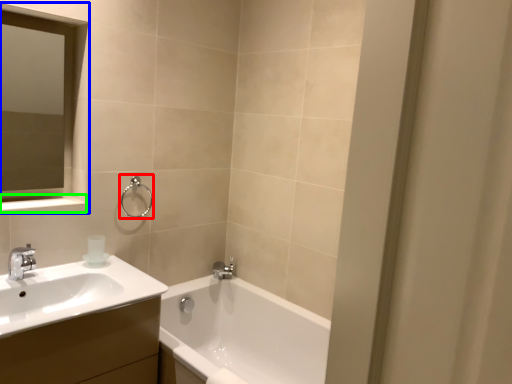
Question: Based on their relative distances, which object is farther from shower (highlighted by a red box)? Choose from medicine cabinet (highlighted by a blue box) and balustrade (highlighted by a green box).

Choices:
 (A) medicine cabinet
 (B) balustrade

Answer: (A)